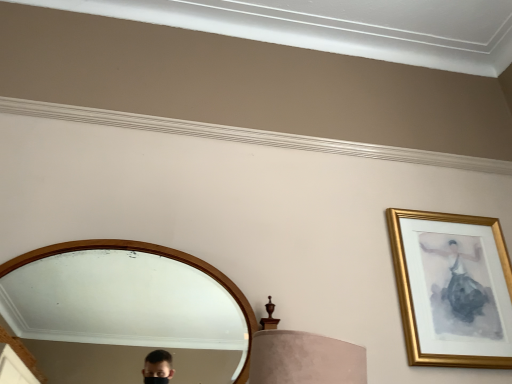
Question: Is gold framed picture at upper right in front of or behind wooden mirror at center in the image?

Choices:
 (A) front
 (B) behind

Answer: (B)

Question: Based on their positions, is gold framed picture at upper right located to the left or right of wooden mirror at center?

Choices:
 (A) right
 (B) left

Answer: (A)

Question: Based on their sizes in the image, would you say gold framed picture at upper right is bigger or smaller than wooden mirror at center?

Choices:
 (A) small
 (B) big

Answer: (A)

Question: Is point (30, 291) positioned closer to the camera than point (496, 312)?

Choices:
 (A) farther
 (B) closer

Answer: (A)

Question: From the image's perspective, is wooden mirror at center positioned above or below gold framed picture at upper right?

Choices:
 (A) above
 (B) below

Answer: (B)

Question: Is wooden mirror at center bigger or smaller than gold framed picture at upper right?

Choices:
 (A) small
 (B) big

Answer: (B)

Question: From a real-world perspective, relative to gold framed picture at upper right, is wooden mirror at center vertically above or below?

Choices:
 (A) below
 (B) above

Answer: (A)